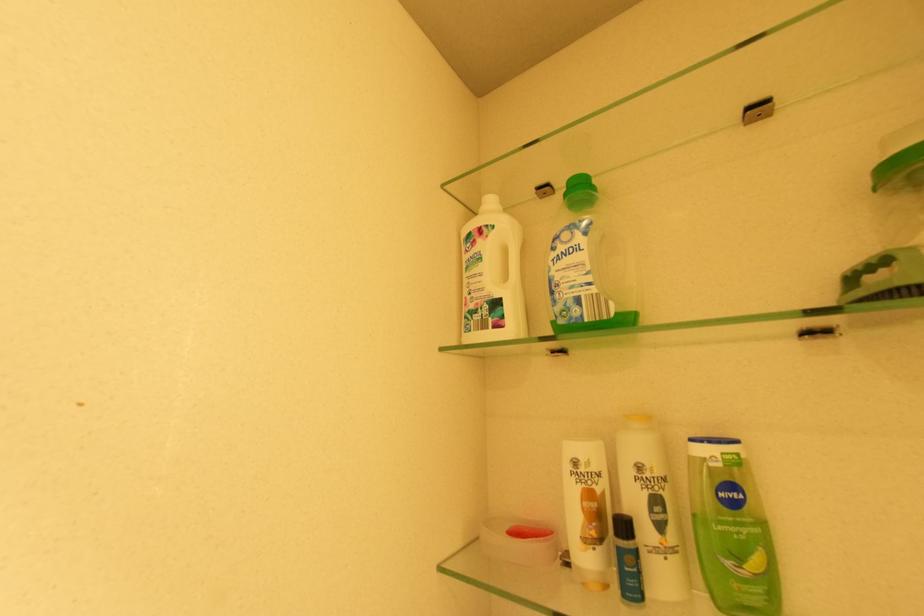
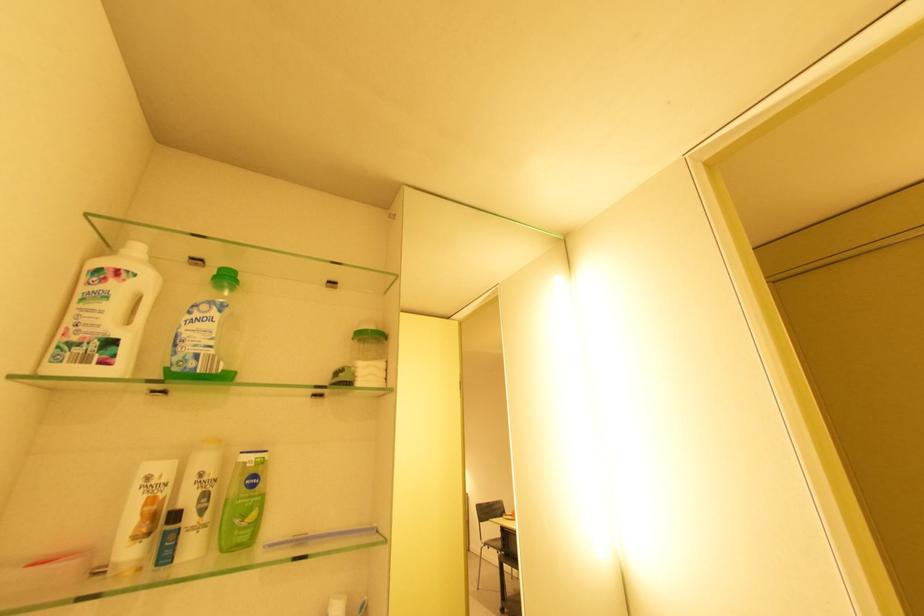
Find the pixel in the second image that matches pixel 569 190 in the first image.

(220, 273)